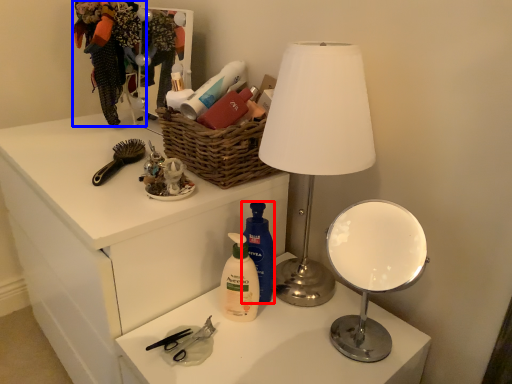
Question: Which object is closer to the camera taking this photo, cleaning product (highlighted by a red box) or clothing (highlighted by a blue box)?

Choices:
 (A) cleaning product
 (B) clothing

Answer: (A)